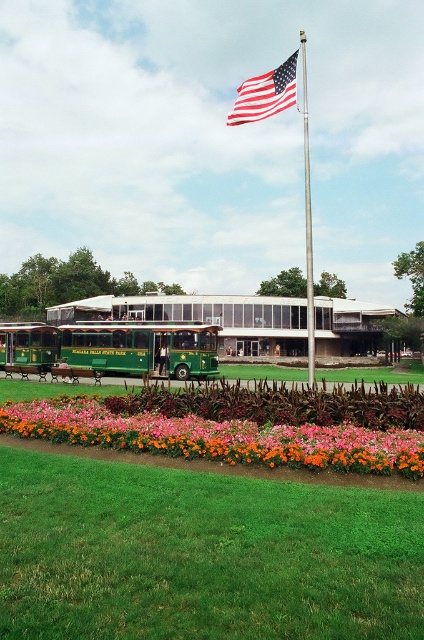
Does green polished wood trolley at center have a lesser width compared to green polished wood trolley at left?

No.

Based on the photo, is green polished wood trolley at center bigger than green polished wood trolley at left?

Incorrect, green polished wood trolley at center is not larger than green polished wood trolley at left.

Describe the element at coordinates (142, 348) in the screenshot. The width and height of the screenshot is (424, 640). I see `green polished wood trolley at center` at that location.

Where is `green polished wood trolley at center`? This screenshot has height=640, width=424. green polished wood trolley at center is located at coordinates (142, 348).

Does vibrant floral bed at center have a greater width compared to american flag at upper center?

In fact, vibrant floral bed at center might be narrower than american flag at upper center.

Does vibrant floral bed at center come behind american flag at upper center?

No, vibrant floral bed at center is in front of american flag at upper center.

Measure the distance between point (268, 429) and camera.

Point (268, 429) is 29.15 feet away from camera.

Identify the location of vibrant floral bed at center. (217, 436).

Is green polished wood trolley at left shorter than polished metal flag pole at center?

Yes.

Find the location of a particular element. This screenshot has height=640, width=424. green polished wood trolley at left is located at coordinates (27, 344).